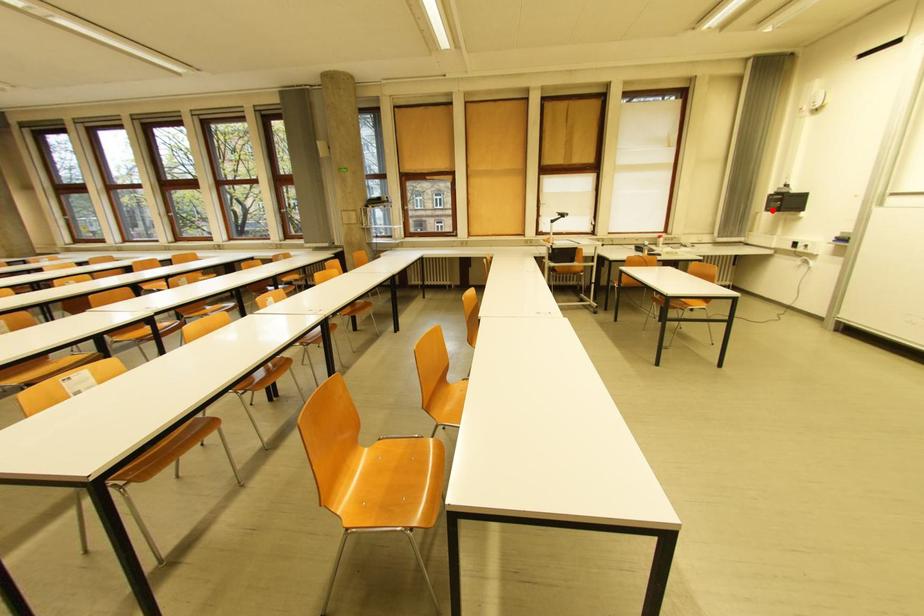
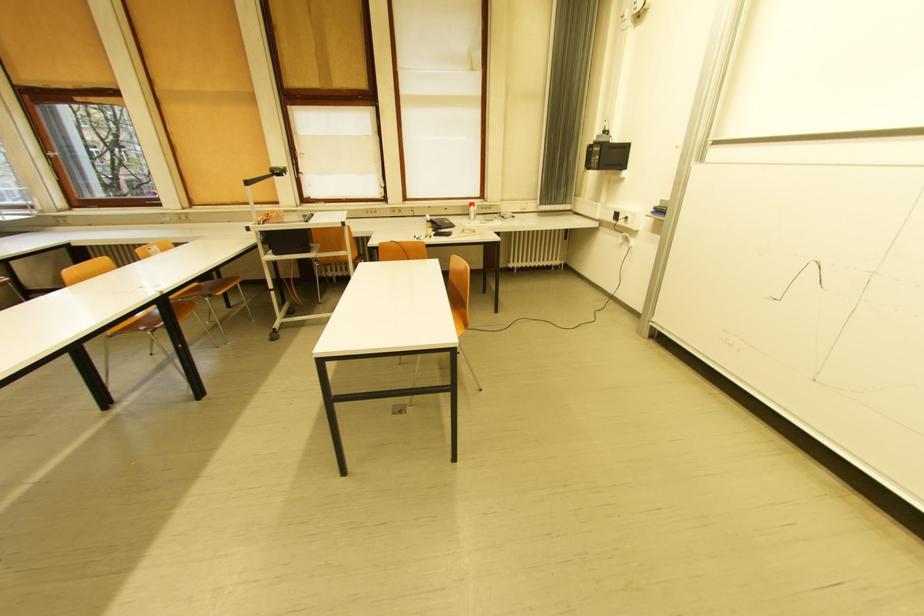
Find the pixel in the second image that matches the highlighted location in the first image.

(592, 168)